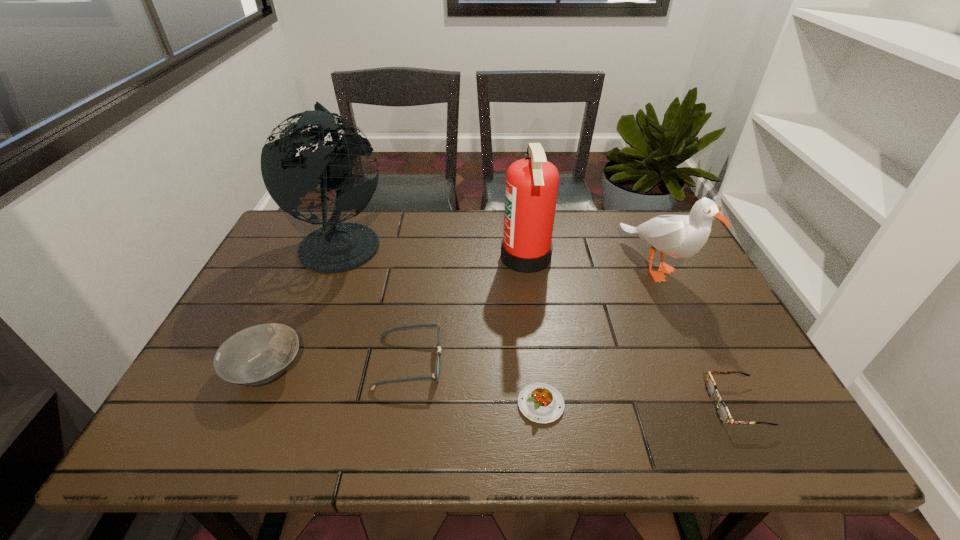
The image size is (960, 540). Find the location of `vacant region located 0.160m at the nozzle of the fire extinguisher`. vacant region located 0.160m at the nozzle of the fire extinguisher is located at coordinates (447, 257).

The height and width of the screenshot is (540, 960). In order to click on blank space located 0.200m at the nozzle of the fire extinguisher in this screenshot , I will do (434, 257).

The image size is (960, 540). What are the coordinates of `free space located at the beak of the fifth shortest object` in the screenshot? It's located at (701, 361).

I want to click on vacant space located 0.310m on the back of the bowl, so click(315, 260).

Locate an element on the screen. The image size is (960, 540). free space located on the face of the third shortest object is located at coordinates (472, 362).

Find the location of a particular element. Image resolution: width=960 pixels, height=540 pixels. vacant point located 0.300m on the frame of the right spectacles is located at coordinates (571, 404).

Where is `free space located on the frame of the right spectacles`? free space located on the frame of the right spectacles is located at coordinates (641, 404).

Find the location of a particular element. vacant space located 0.370m on the frame of the right spectacles is located at coordinates (539, 404).

Find the location of a particular element. This screenshot has width=960, height=540. blank area located 0.090m on the left of the pudding is located at coordinates point(475,404).

This screenshot has width=960, height=540. I want to click on globe present at the far edge, so click(x=336, y=247).